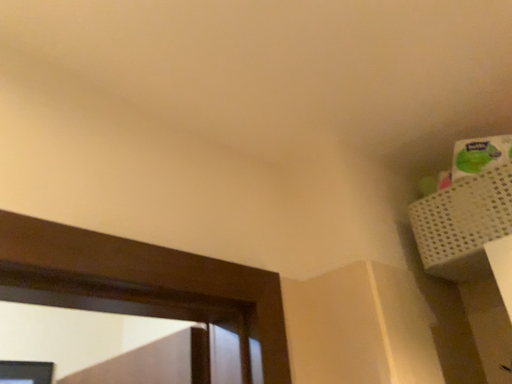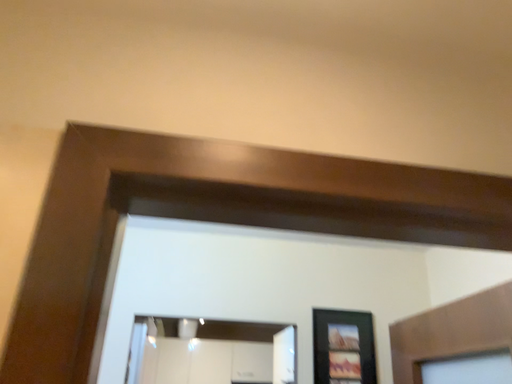
Question: Which way did the camera rotate in the video?

Choices:
 (A) rotated downward
 (B) rotated upward

Answer: (A)